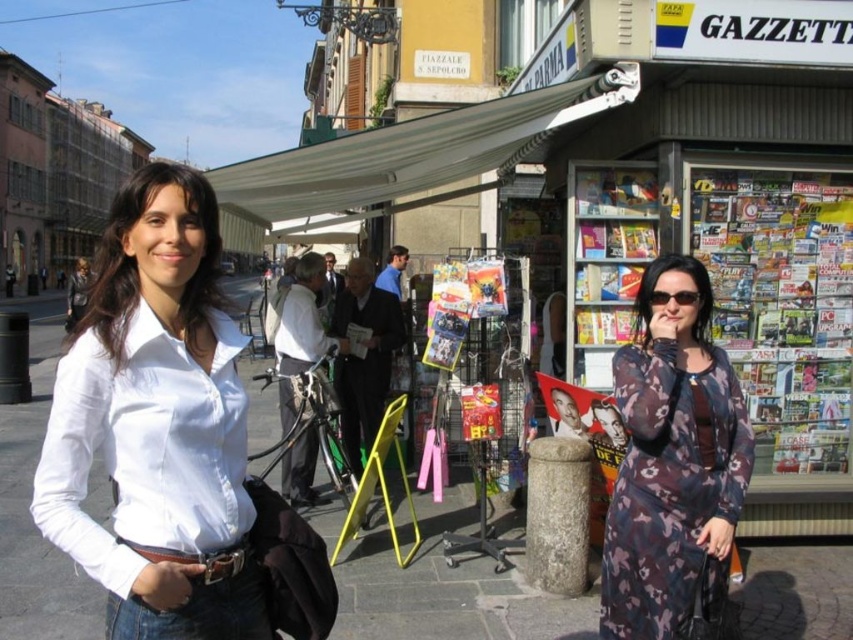
Question: Is the position of white fabric canopy at upper center less distant than that of brown leather belt at lower left?

Choices:
 (A) no
 (B) yes

Answer: (A)

Question: Can you confirm if floral-patterned fabric dress at lower right is bigger than matte black sunglasses at center?

Choices:
 (A) no
 (B) yes

Answer: (B)

Question: Which point is closer to the camera?

Choices:
 (A) (74, 481)
 (B) (352, 346)

Answer: (A)

Question: Which of the following is the closest to the observer?

Choices:
 (A) (659, 556)
 (B) (679, 300)
 (C) (357, 355)
 (D) (175, 232)

Answer: (D)

Question: Which of the following is the closest to the observer?

Choices:
 (A) (688, 301)
 (B) (679, 422)
 (C) (253, 509)

Answer: (C)

Question: Is brown leather belt at lower left above matte plastic magazine at center?

Choices:
 (A) yes
 (B) no

Answer: (B)